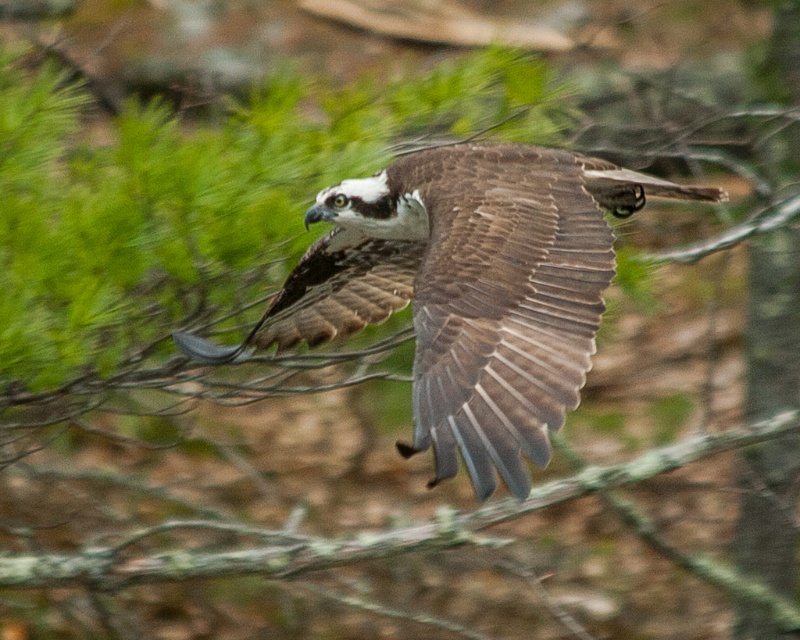
Question: Is brown feathered wing at center wider than green mossy branch at center?

Choices:
 (A) yes
 (B) no

Answer: (B)

Question: Is brown feathered eagle at center to the right of brown feathered wing at center from the viewer's perspective?

Choices:
 (A) yes
 (B) no

Answer: (A)

Question: Estimate the real-world distances between objects in this image. Which object is farther from the brown feathered eagle at center?

Choices:
 (A) brown feathered wing at center
 (B) green mossy branch at center

Answer: (B)

Question: Observing the image, what is the correct spatial positioning of brown feathered eagle at center in reference to brown feathered wing at center?

Choices:
 (A) left
 (B) right

Answer: (B)

Question: Which of these objects is positioned farthest from the brown feathered eagle at center?

Choices:
 (A) green mossy branch at center
 (B) brown feathered wing at center

Answer: (A)

Question: Among these points, which one is farthest from the camera?

Choices:
 (A) (416, 308)
 (B) (545, 403)

Answer: (A)